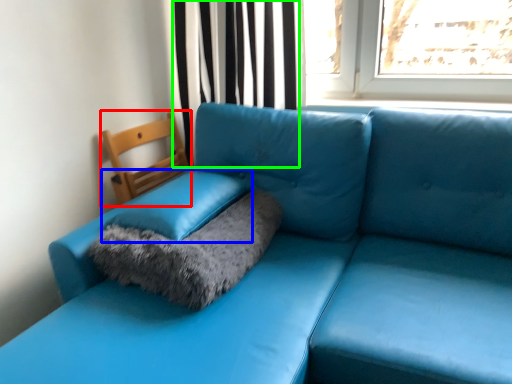
Question: Based on their relative distances, which object is nearer to armchair (highlighted by a red box)? Choose from pillow (highlighted by a blue box) and curtain (highlighted by a green box).

Choices:
 (A) pillow
 (B) curtain

Answer: (B)